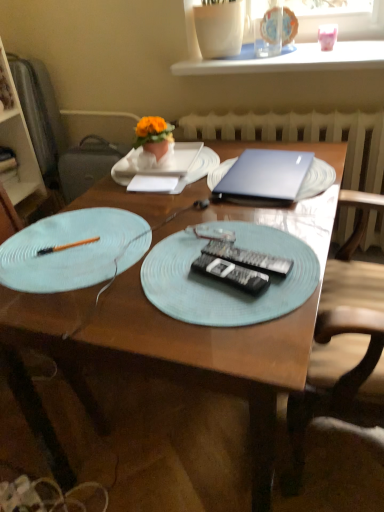
At what (x,y) coordinates should I click in order to perform the action: click on free space between transparent glass cup at upper center, which ranks as the first tableware in left-to-right order, and pink glossy piggy bank at upper right, acting as the second tableware starting from the left. Please return your answer as a coordinate pair (x, y). The width and height of the screenshot is (384, 512). Looking at the image, I should click on (303, 50).